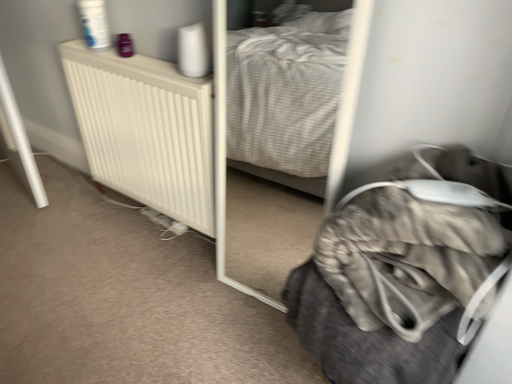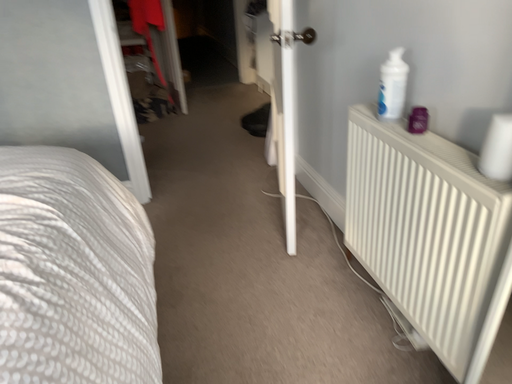
Question: How did the camera likely rotate when shooting the video?

Choices:
 (A) rotated upward
 (B) rotated downward

Answer: (A)